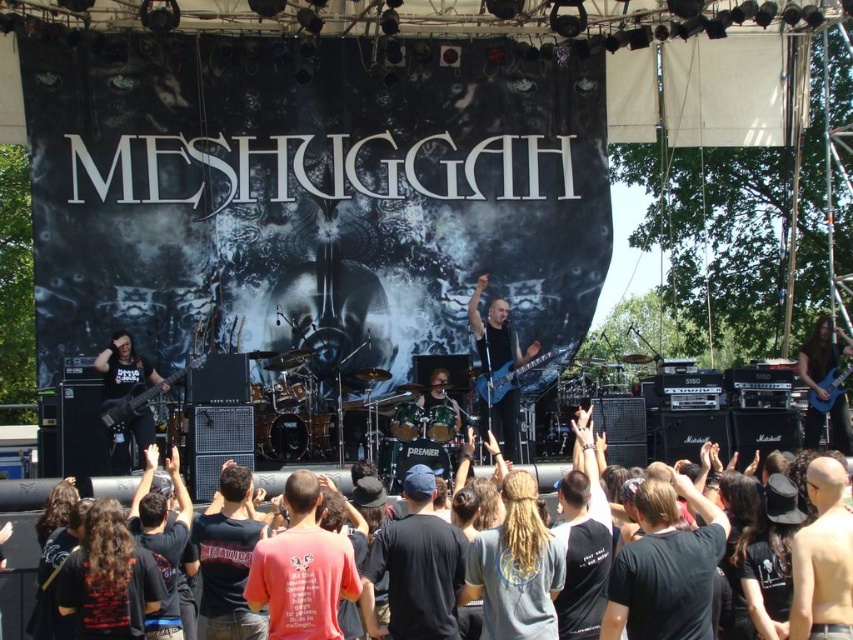
Is blue glossy electric guitar at upper right taller than shiny black drum set at center?

Indeed, blue glossy electric guitar at upper right has a greater height compared to shiny black drum set at center.

The height and width of the screenshot is (640, 853). What do you see at coordinates (821, 355) in the screenshot?
I see `blue glossy electric guitar at upper right` at bounding box center [821, 355].

Where is `blue glossy electric guitar at upper right`? This screenshot has width=853, height=640. blue glossy electric guitar at upper right is located at coordinates (821, 355).

Consider the image. Who is positioned more to the left, matte black bass guitar at left or blue glossy electric guitar at upper right?

From the viewer's perspective, matte black bass guitar at left appears more on the left side.

Does matte black bass guitar at left have a lesser width compared to blue glossy electric guitar at upper right?

Yes, matte black bass guitar at left is thinner than blue glossy electric guitar at upper right.

Is point (120, 449) closer to camera compared to point (815, 324)?

Yes, point (120, 449) is closer to viewer.

Locate an element on the screen. The image size is (853, 640). matte black bass guitar at left is located at coordinates (125, 371).

Is point (506, 364) farther from camera compared to point (444, 380)?

No, (506, 364) is in front of (444, 380).

From the picture: Who is more distant from viewer, (480, 403) or (438, 387)?

The point (438, 387) is more distant.

Find the location of a particular element. This screenshot has width=853, height=640. shiny black guitar at center is located at coordinates (496, 333).